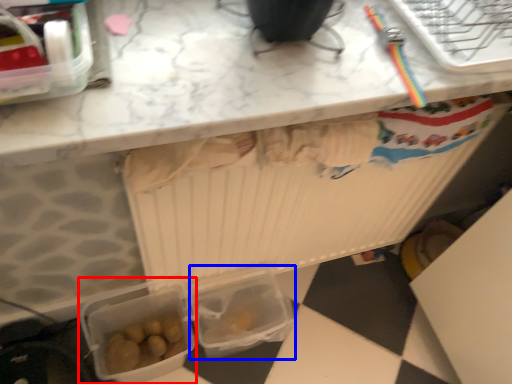
Question: Which object appears closest to the camera in this image, lunch box (highlighted by a red box) or lunch box (highlighted by a blue box)?

Choices:
 (A) lunch box
 (B) lunch box

Answer: (A)